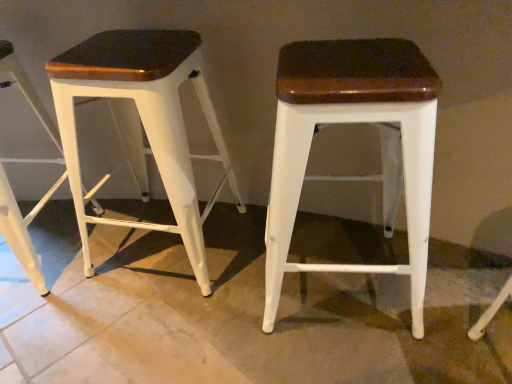
Where is `vacant area on top of matte white stool at left, which is the second stool from right to left (from a real-world perspective)`? vacant area on top of matte white stool at left, which is the second stool from right to left (from a real-world perspective) is located at coordinates (128, 46).